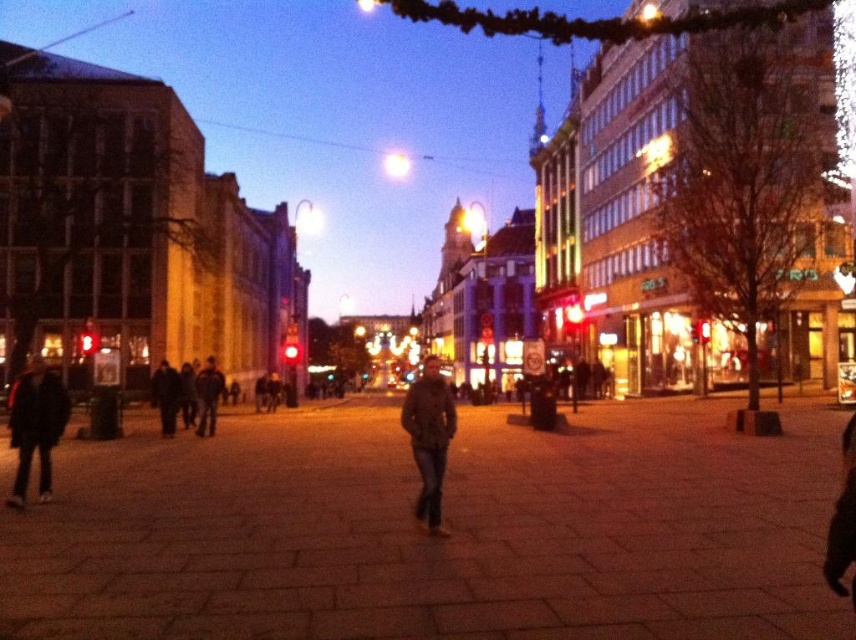
You are a delivery robot with a 2.5 meter long package. You need to navigate through the pedestrian plaza between the dark blue jeans at center and the dark gray jacket at left. Will the package fit through the space between them?

The distance between the dark blue jeans at center and the dark gray jacket at left is 3.27 meters. Since the package is 2.5 meters long, it will fit through the space between them as the distance is greater than the package length.

Based on the photo, you are standing in the pedestrian plaza and notice a man wearing a brown leather jacket at center. If you want to approach him, in which direction should you move relative to your current position?

The brown leather jacket at center is located at point 0.684 on the horizontal axis and 0.502 on the vertical axis. Since the man is in the center of the frame, you should move towards the center of the plaza to reach him.

You are a photographer standing in the plaza and want to take a photo of the dark brown leather jacket at lower left and the dark blue jeans at center. Which object should you adjust your camera to focus on first if you want to capture both in the same frame?

The dark brown leather jacket at lower left is positioned on the left side of dark blue jeans at center, so you should focus on the dark brown leather jacket at lower left first to ensure both are in the frame.